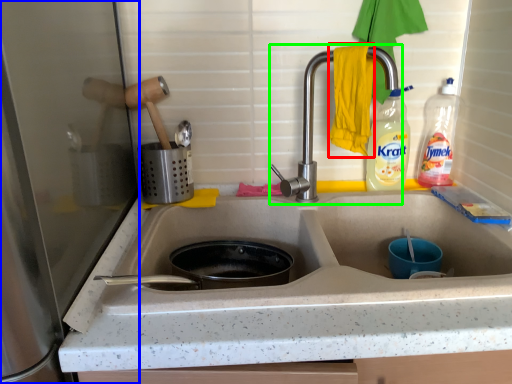
Question: Estimate the real-world distances between objects in this image. Which object is farther from hand towel (highlighted by a red box), appliance (highlighted by a blue box) or tap (highlighted by a green box)?

Choices:
 (A) appliance
 (B) tap

Answer: (A)